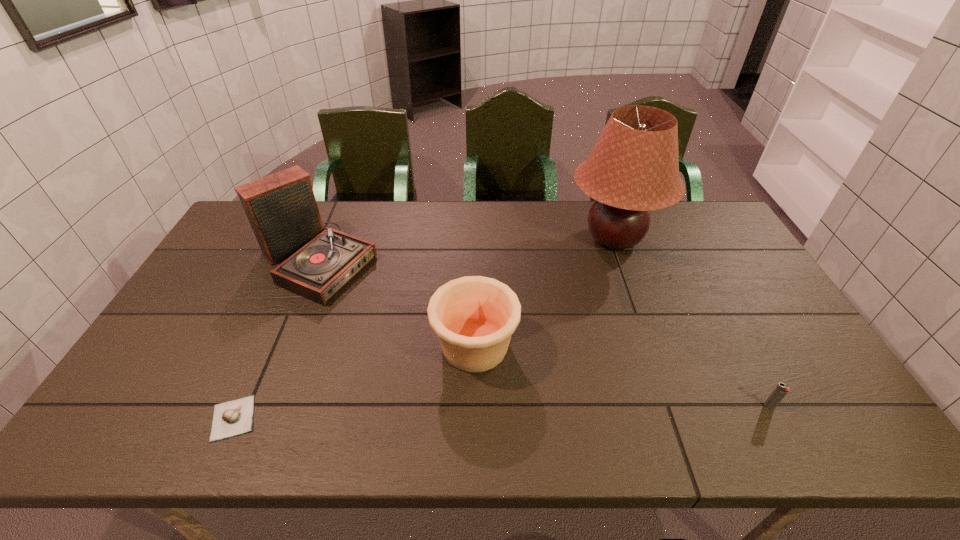
Where is `the tallest object`? the tallest object is located at coordinates (633, 168).

This screenshot has width=960, height=540. I want to click on the second object from right to left, so click(x=633, y=168).

In order to click on the fourth shortest object in this screenshot , I will do `click(281, 208)`.

Locate an element on the screen. pottery is located at coordinates (474, 317).

This screenshot has width=960, height=540. Identify the location of the third tallest object. (474, 317).

Where is `the fourth tallest object`? The image size is (960, 540). the fourth tallest object is located at coordinates (781, 390).

You are a GUI agent. You are given a task and a screenshot of the screen. Output one action in this format:
    pyautogui.click(x=<x>, y=<y>)
    Task: Click on the rightmost object
    
    Given the screenshot: What is the action you would take?
    pyautogui.click(x=781, y=390)

You are a GUI agent. You are given a task and a screenshot of the screen. Output one action in this format:
    pyautogui.click(x=<x>, y=<y>)
    Task: Click on the shortest object
    This screenshot has height=540, width=960.
    Given the screenshot: What is the action you would take?
    pyautogui.click(x=235, y=417)

Identify the location of vacant space positioned on the front-facing side of the fourth object from left to right. The image size is (960, 540). (477, 239).

The image size is (960, 540). What are the coordinates of `vacant region located on the front-facing side of the fourth object from left to right` in the screenshot? It's located at (521, 239).